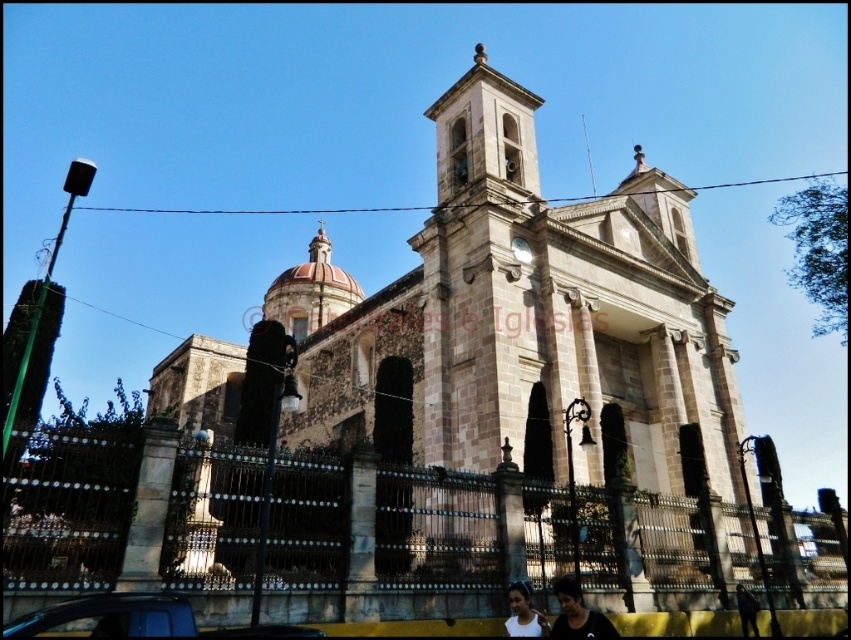
You are standing in front of the historic church and see a white matte shirt at lower center. Where is the white matte shirt located relative to the church?

The white matte shirt at lower center is located at the lower center area in front of the church.

Consider the image. You are a photographer standing in front of the historic church. You notice a white matte shirt at lower center and a dark blue fabric at lower right in your frame. Which item is covering the other one?

The white matte shirt at lower center is positioned over the dark blue fabric at lower right, meaning it is covering it.

In the scene shown: You are standing in front of the historic church and notice two points marked on the facade. The first point is at coordinates point (126, 627) and the second is at point (563, 618). Which point is closer to you?

Point (126, 627) is closer to the viewer than point (563, 618).